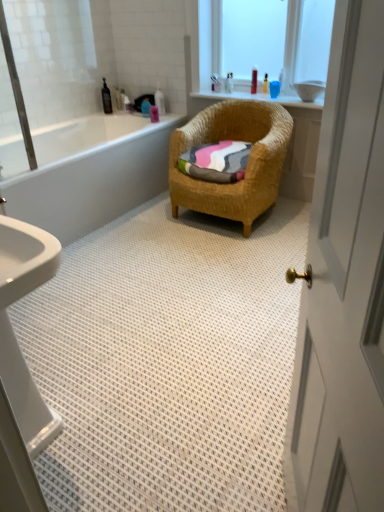
Where is `transparent plastic container at upper center`? This screenshot has width=384, height=512. transparent plastic container at upper center is located at coordinates click(x=259, y=97).

Describe the element at coordinates (247, 164) in the screenshot. I see `woven wicker chair at center` at that location.

Based on the photo, measure the distance between woven wicker chair at center and camera.

The depth of woven wicker chair at center is 9.07 feet.

What is the approximate width of blue plastic bottle at upper center, which appears as the 6th toiletry when viewed from the right?

blue plastic bottle at upper center, which appears as the 6th toiletry when viewed from the right, is 8.07 centimeters wide.

Describe the element at coordinates (216, 161) in the screenshot. I see `multicolored woven towel at center` at that location.

Locate an element on the screen. The height and width of the screenshot is (512, 384). white glossy door at right is located at coordinates (343, 286).

Between black plastic bottle at upper left, placed as the 1th toiletry when sorted from left to right, and translucent plastic bottle at upper center, the first toiletry positioned from the right, which one has smaller size?

With smaller size is translucent plastic bottle at upper center, the first toiletry positioned from the right.

Would you say black plastic bottle at upper left, positioned as the seventh toiletry in right-to-left order, is a long distance from translucent plastic bottle at upper center, which is the 7th toiletry from left to right?

Absolutely, black plastic bottle at upper left, positioned as the seventh toiletry in right-to-left order, is distant from translucent plastic bottle at upper center, which is the 7th toiletry from left to right.

Does point (108, 111) come farther from viewer compared to point (254, 72)?

Yes, point (108, 111) is farther from viewer.

From the picture: How far apart are multicolored woven towel at center and white glossy door at right?

multicolored woven towel at center is 2.09 meters from white glossy door at right.

How many degrees apart are the facing directions of multicolored woven towel at center and white glossy door at right?

multicolored woven towel at center and white glossy door at right are facing 62 degrees away from each other.

Can you confirm if multicolored woven towel at center is positioned to the left of white glossy door at right?

Yes, multicolored woven towel at center is to the left of white glossy door at right.

Which is further, (210, 148) or (333, 353)?

Point (210, 148)

The image size is (384, 512). Identify the location of the 4th toiletry located above the pink matte bottle at upper center, the 3th toiletry viewed from the left (from a real-world perspective). (229, 82).

Based on the photo, looking at their sizes, would you say pink matte bottle at upper center, the 5th toiletry viewed from the right, is wider or thinner than translucent plastic bottle at upper center, marked as the second toiletry in a right-to-left arrangement?

pink matte bottle at upper center, the 5th toiletry viewed from the right, is thinner than translucent plastic bottle at upper center, marked as the second toiletry in a right-to-left arrangement.

Who is smaller, pink matte bottle at upper center, the 3th toiletry viewed from the left, or translucent plastic bottle at upper center, marked as the second toiletry in a right-to-left arrangement?

Smaller between the two is translucent plastic bottle at upper center, marked as the second toiletry in a right-to-left arrangement.

Is pink matte bottle at upper center, the 3th toiletry viewed from the left, taller than translucent plastic bottle at upper center, marked as the second toiletry in a right-to-left arrangement?

Yes, pink matte bottle at upper center, the 3th toiletry viewed from the left, is taller than translucent plastic bottle at upper center, marked as the second toiletry in a right-to-left arrangement.

Is point (219, 85) closer to camera compared to point (355, 301)?

No, (219, 85) is further to viewer.

Starting from the white glossy door at right, which toiletry is the 3rd one behind? Please provide its 2D coordinates.

[(215, 82)]

Considering the relative sizes of translucent plastic bottle at upper center, marked as the third toiletry in a right-to-left arrangement, and white glossy door at right in the image provided, is translucent plastic bottle at upper center, marked as the third toiletry in a right-to-left arrangement, thinner than white glossy door at right?

→ Indeed, translucent plastic bottle at upper center, marked as the third toiletry in a right-to-left arrangement, has a lesser width compared to white glossy door at right.

Is translucent plastic bottle at upper center, which is the 5th toiletry from left to right, in contact with white glossy door at right?

No, translucent plastic bottle at upper center, which is the 5th toiletry from left to right, is not making contact with white glossy door at right.

Which is more distant, (145, 113) or (247, 99)?

The point (145, 113) is behind.

From the image's perspective, between blue plastic bottle at upper center, placed as the second toiletry when sorted from left to right, and transparent plastic container at upper center, which one is located above?

blue plastic bottle at upper center, placed as the second toiletry when sorted from left to right.

Is blue plastic bottle at upper center, which appears as the 6th toiletry when viewed from the right, bigger than transparent plastic container at upper center?

No, blue plastic bottle at upper center, which appears as the 6th toiletry when viewed from the right, is not bigger than transparent plastic container at upper center.

How different are the orientations of blue plastic bottle at upper center, which appears as the 6th toiletry when viewed from the right, and transparent plastic container at upper center in degrees?

The angle between the facing direction of blue plastic bottle at upper center, which appears as the 6th toiletry when viewed from the right, and the facing direction of transparent plastic container at upper center is 0.593 degrees.

Is translucent plastic bottle at upper center, the sixth toiletry when ordered from left to right, at the right side of multicolored woven towel at center?

Indeed, translucent plastic bottle at upper center, the sixth toiletry when ordered from left to right, is positioned on the right side of multicolored woven towel at center.

From a real-world perspective, is translucent plastic bottle at upper center, marked as the second toiletry in a right-to-left arrangement, physically below multicolored woven towel at center?

Result: Incorrect, from a real-world perspective, translucent plastic bottle at upper center, marked as the second toiletry in a right-to-left arrangement, is higher than multicolored woven towel at center.

Does translucent plastic bottle at upper center, the sixth toiletry when ordered from left to right, turn towards multicolored woven towel at center?

No.

Considering the relative sizes of translucent plastic bottle at upper center, the sixth toiletry when ordered from left to right, and multicolored woven towel at center in the image provided, is translucent plastic bottle at upper center, the sixth toiletry when ordered from left to right, thinner than multicolored woven towel at center?

Yes.

From the image's perspective, relative to translucent plastic bottle at upper center, which is the 5th toiletry from left to right, is transparent plastic container at upper center above or below?

From the image's perspective, transparent plastic container at upper center appears below translucent plastic bottle at upper center, which is the 5th toiletry from left to right.

Between transparent plastic container at upper center and translucent plastic bottle at upper center, marked as the third toiletry in a right-to-left arrangement, which one has larger size?

transparent plastic container at upper center.

In the image, is transparent plastic container at upper center positioned in front of or behind translucent plastic bottle at upper center, marked as the third toiletry in a right-to-left arrangement?

Visually, transparent plastic container at upper center is located in front of translucent plastic bottle at upper center, marked as the third toiletry in a right-to-left arrangement.

This screenshot has width=384, height=512. In order to click on the 3rd toiletry directly above the black plastic bottle at upper left, placed as the 1th toiletry when sorted from left to right (from a real-world perspective) in this screenshot , I will do `click(254, 80)`.

Where is `bath towel on the left side of white glossy door at right`? This screenshot has height=512, width=384. bath towel on the left side of white glossy door at right is located at coordinates (216, 161).

Considering their positions, is translucent plastic bottle at upper center, the sixth toiletry when ordered from left to right, positioned closer to white glossy bathtub at left than transparent plastic container at upper center?

transparent plastic container at upper center.

Looking at the image, which one is located further to multicolored woven towel at center, white glossy bathtub at left or white glossy door at right?

The object further to multicolored woven towel at center is white glossy door at right.

Based on their spatial positions, is white glossy door at right or translucent plastic bottle at upper center, the sixth toiletry when ordered from left to right, closer to multicolored woven towel at center?

Among the two, translucent plastic bottle at upper center, the sixth toiletry when ordered from left to right, is located nearer to multicolored woven towel at center.

Estimate the real-world distances between objects in this image. Which object is further from transparent plastic container at upper center, white glossy door at right or blue plastic bottle at upper center, placed as the second toiletry when sorted from left to right?

The object further to transparent plastic container at upper center is white glossy door at right.

Looking at the image, which one is located closer to transparent plastic container at upper center, translucent plastic bottle at upper center, the first toiletry positioned from the right, or white glossy bottle at upper center, which appears as the fourth toiletry when viewed from the right?

translucent plastic bottle at upper center, the first toiletry positioned from the right.

Which object lies nearer to the anchor point woven wicker chair at center, translucent plastic bottle at upper center, the sixth toiletry when ordered from left to right, or pink matte bottle at upper center, the 3th toiletry viewed from the left?

translucent plastic bottle at upper center, the sixth toiletry when ordered from left to right, is closer to woven wicker chair at center.

Looking at the image, which one is located further to blue plastic bottle at upper center, which appears as the 6th toiletry when viewed from the right, transparent plastic container at upper center or woven wicker chair at center?

woven wicker chair at center is positioned further to the anchor blue plastic bottle at upper center, which appears as the 6th toiletry when viewed from the right.

Which object lies nearer to the anchor point multicolored woven towel at center, pink matte bottle at upper center, the 5th toiletry viewed from the right, or blue plastic bottle at upper center, which appears as the 6th toiletry when viewed from the right?

The object closer to multicolored woven towel at center is pink matte bottle at upper center, the 5th toiletry viewed from the right.

Identify the location of bathtub located between white glossy door at right and woven wicker chair at center in the depth direction. This screenshot has height=512, width=384. (94, 183).

Locate an element on the screen. chair between white glossy door at right and white glossy bottle at upper center, which appears as the fourth toiletry when viewed from the right, along the z-axis is located at coordinates (247, 164).

At what (x,y) coordinates should I click in order to perform the action: click on balustrade between white glossy door at right and pink matte bottle at upper center, the 5th toiletry viewed from the right, from front to back. Please return your answer as a coordinate pair (x, y). The image size is (384, 512). Looking at the image, I should click on (259, 97).

The width and height of the screenshot is (384, 512). I want to click on toiletry located between white glossy bottle at upper center, arranged as the fourth toiletry when viewed from the left, and translucent plastic bottle at upper center, marked as the second toiletry in a right-to-left arrangement, in the left-right direction, so click(215, 82).